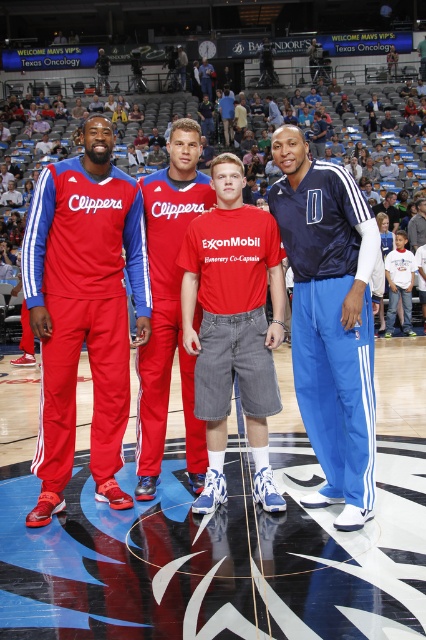
You are standing at the center of the basketball court and see two points marked on the floor. The first point is at coordinate point(97, 564) and the second is at point(167, 188). Which point is closer to you?

Point(97, 564) is closer to you because it is in front of point(167, 188).

You are a photographer standing at the edge of the basketball court. You want to take a photo of the shiny black floor at center and the red matte track pants at center. How far apart are these two objects in feet?

The distance between the shiny black floor at center and the red matte track pants at center is 6.96 feet.